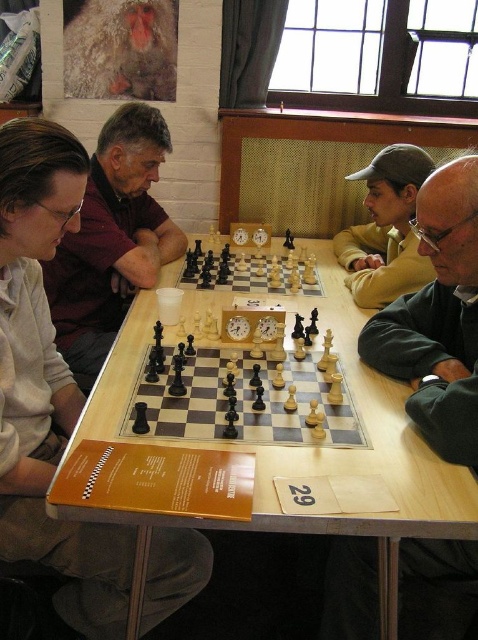
Question: Which point is farther from the camera taking this photo?

Choices:
 (A) (176, 426)
 (B) (206, 540)
 (C) (250, 449)
 (D) (164, 140)

Answer: (D)

Question: Does wooden chess set at center appear on the right side of light wood chess set at center?

Choices:
 (A) no
 (B) yes

Answer: (A)

Question: Can you confirm if wooden chessboard at center is positioned above matte black chess set at left?

Choices:
 (A) yes
 (B) no

Answer: (B)

Question: Among these points, which one is farthest from the camera?

Choices:
 (A) (207, 349)
 (B) (3, 280)
 (C) (346, 259)
 (D) (119, 124)

Answer: (C)

Question: Which object appears closest to the camera in this image?

Choices:
 (A) wooden chessboard at center
 (B) light brown sweater at left
 (C) matte black chess set at left
 (D) khaki cotton cap at upper right

Answer: (A)

Question: Can you confirm if wooden chessboard at center is positioned above khaki cotton cap at upper right?

Choices:
 (A) yes
 (B) no

Answer: (B)